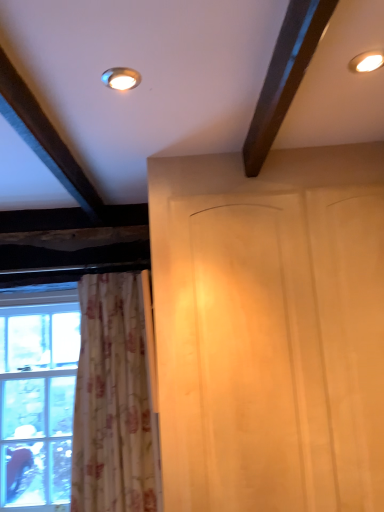
Image resolution: width=384 pixels, height=512 pixels. In order to click on clear glass window at left in this screenshot , I will do `click(37, 397)`.

Is white floral fabric curtain at left positioned behind clear glass window at left?

No, white floral fabric curtain at left is closer to the viewer.

Would you consider white floral fabric curtain at left to be distant from clear glass window at left?

No, there isn't a large distance between white floral fabric curtain at left and clear glass window at left.

Which is correct: white floral fabric curtain at left is inside clear glass window at left, or outside of it?

white floral fabric curtain at left is not inside clear glass window at left, it's outside.

Where is `window lying on the left of white floral fabric curtain at left`? This screenshot has width=384, height=512. window lying on the left of white floral fabric curtain at left is located at coordinates (37, 397).

How far apart are clear glass window at left and white floral fabric curtain at left?

The distance of clear glass window at left from white floral fabric curtain at left is 19.88 inches.

How many degrees apart are the facing directions of clear glass window at left and white floral fabric curtain at left?

0.0332 degrees.

From the image's perspective, relative to white floral fabric curtain at left, is clear glass window at left above or below?

Clearly, from the image's perspective, clear glass window at left is below white floral fabric curtain at left.

Does matte gold light fixture at upper center, which appears as the second lighting when viewed from the right, have a greater width compared to clear glass window at left?

Incorrect, the width of matte gold light fixture at upper center, which appears as the second lighting when viewed from the right, does not surpass that of clear glass window at left.

Can you confirm if matte gold light fixture at upper center, the 1th lighting positioned from the bottom, is shorter than clear glass window at left?

Yes.

Is matte gold light fixture at upper center, the 2th lighting when ordered from top to bottom, oriented towards clear glass window at left?

No, matte gold light fixture at upper center, the 2th lighting when ordered from top to bottom, is not oriented towards clear glass window at left.

Who is more distant, matte gold light fixture at upper center, positioned as the 1th lighting in left-to-right order, or clear glass window at left?

clear glass window at left is further from the camera.

Is clear glass window at left not inside white wood screen door at center?

clear glass window at left lies outside white wood screen door at center's area.

Consider the image. What's the angular difference between clear glass window at left and white wood screen door at center's facing directions?

The facing directions of clear glass window at left and white wood screen door at center are 0.0332 degrees apart.

Does point (6, 405) lie in front of point (340, 467)?

No.

Is clear glass window at left taller than white wood screen door at center?

No, clear glass window at left is not taller than white wood screen door at center.

Identify the location of the 2nd lighting above the white wood screen door at center (from the image's perspective). This screenshot has width=384, height=512. (367, 62).

Between white wood screen door at center and matte white light fixture at upper right, positioned as the first lighting in top-to-bottom order, which one has larger size?

With larger size is white wood screen door at center.

From the image's perspective, is white wood screen door at center located above matte white light fixture at upper right, the 2th lighting from the left?

No.

Between point (112, 73) and point (336, 288), which one is positioned behind?

Point (336, 288)

From the image's perspective, which one is positioned higher, matte gold light fixture at upper center, which appears as the second lighting when viewed from the right, or white wood screen door at center?

Answer: matte gold light fixture at upper center, which appears as the second lighting when viewed from the right.

How many degrees apart are the facing directions of matte gold light fixture at upper center, positioned as the 1th lighting in left-to-right order, and white wood screen door at center?

0.00111 degrees separate the facing orientations of matte gold light fixture at upper center, positioned as the 1th lighting in left-to-right order, and white wood screen door at center.

Is matte gold light fixture at upper center, the 1th lighting positioned from the bottom, surrounding white wood screen door at center?

No, white wood screen door at center is not a part of matte gold light fixture at upper center, the 1th lighting positioned from the bottom.

Is white floral fabric curtain at left turned away from matte gold light fixture at upper center, the 1th lighting positioned from the bottom?

No, matte gold light fixture at upper center, the 1th lighting positioned from the bottom, is not at the back of white floral fabric curtain at left.

Is white floral fabric curtain at left inside the boundaries of matte gold light fixture at upper center, the 1th lighting positioned from the bottom, or outside?

white floral fabric curtain at left lies outside matte gold light fixture at upper center, the 1th lighting positioned from the bottom.

Does white floral fabric curtain at left touch matte gold light fixture at upper center, the 2th lighting when ordered from top to bottom?

white floral fabric curtain at left and matte gold light fixture at upper center, the 2th lighting when ordered from top to bottom, are not in contact.

Which is in front, point (116, 305) or point (121, 69)?

Positioned in front is point (121, 69).

You are a GUI agent. You are given a task and a screenshot of the screen. Output one action in this format:
    pyautogui.click(x=<x>, y=<y>)
    Task: Click on the curtain lying in front of the clear glass window at left
    
    Given the screenshot: What is the action you would take?
    pyautogui.click(x=116, y=398)

This screenshot has height=512, width=384. What are the coordinates of `curtain on the right of clear glass window at left` in the screenshot? It's located at (116, 398).

Considering their positions, is matte gold light fixture at upper center, which appears as the second lighting when viewed from the right, positioned further to clear glass window at left than white wood screen door at center?

matte gold light fixture at upper center, which appears as the second lighting when viewed from the right, is positioned further to the anchor clear glass window at left.

Looking at the image, which one is located further to white floral fabric curtain at left, matte gold light fixture at upper center, the 1th lighting positioned from the bottom, or white wood screen door at center?

matte gold light fixture at upper center, the 1th lighting positioned from the bottom, is further to white floral fabric curtain at left.

From the image, which object appears to be nearer to white wood screen door at center, matte white light fixture at upper right, positioned as the first lighting in top-to-bottom order, or white floral fabric curtain at left?

Among the two, white floral fabric curtain at left is located nearer to white wood screen door at center.

Based on their spatial positions, is white wood screen door at center or clear glass window at left closer to matte gold light fixture at upper center, the 2th lighting when ordered from top to bottom?

Among the two, white wood screen door at center is located nearer to matte gold light fixture at upper center, the 2th lighting when ordered from top to bottom.

Which object lies further to the anchor point matte white light fixture at upper right, the 2th lighting from the left, matte gold light fixture at upper center, positioned as the 1th lighting in left-to-right order, or white wood screen door at center?

Among the two, white wood screen door at center is located further to matte white light fixture at upper right, the 2th lighting from the left.

Looking at this image, looking at the image, which one is located further to clear glass window at left, white wood screen door at center or matte gold light fixture at upper center, the 1th lighting positioned from the bottom?

matte gold light fixture at upper center, the 1th lighting positioned from the bottom, is further to clear glass window at left.

Considering their positions, is white floral fabric curtain at left positioned further to matte white light fixture at upper right, positioned as the first lighting in top-to-bottom order, than clear glass window at left?

The object further to matte white light fixture at upper right, positioned as the first lighting in top-to-bottom order, is clear glass window at left.

From the image, which object appears to be nearer to matte gold light fixture at upper center, which appears as the second lighting when viewed from the right, clear glass window at left or white floral fabric curtain at left?

white floral fabric curtain at left is closer to matte gold light fixture at upper center, which appears as the second lighting when viewed from the right.

The width and height of the screenshot is (384, 512). I want to click on screen door between matte white light fixture at upper right, positioned as the first lighting in top-to-bottom order, and white floral fabric curtain at left, in the vertical direction, so click(x=273, y=351).

Image resolution: width=384 pixels, height=512 pixels. I want to click on curtain between matte gold light fixture at upper center, the 2th lighting when ordered from top to bottom, and clear glass window at left from top to bottom, so click(x=116, y=398).

Locate an element on the screen. The height and width of the screenshot is (512, 384). lighting between matte white light fixture at upper right, the 1th lighting when ordered from right to left, and white wood screen door at center from top to bottom is located at coordinates (121, 78).

This screenshot has height=512, width=384. I want to click on lighting between matte white light fixture at upper right, positioned as the first lighting in top-to-bottom order, and white floral fabric curtain at left from top to bottom, so click(121, 78).